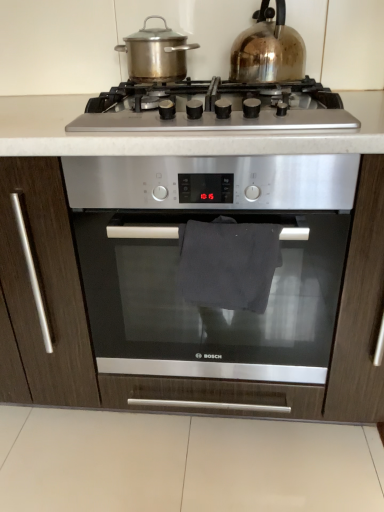
I want to click on free location in front of shiny metallic kettle at upper right, which is counted as the 1th kitchen appliance, starting from the right, so click(249, 87).